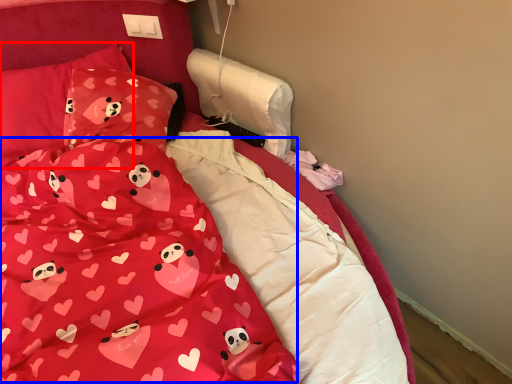
Question: Among these objects, which one is nearest to the camera, pillow (highlighted by a red box) or blanket (highlighted by a blue box)?

Choices:
 (A) pillow
 (B) blanket

Answer: (B)